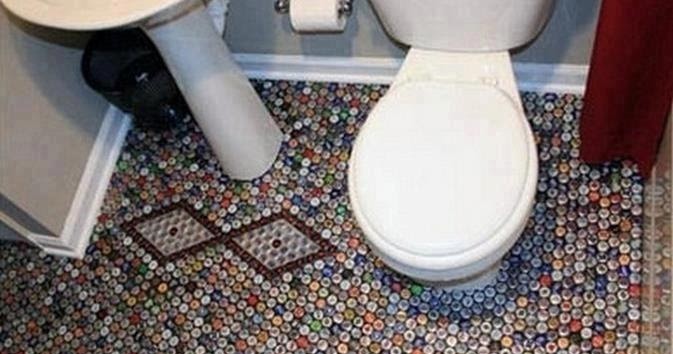
Identify the location of sink. (213, 72).